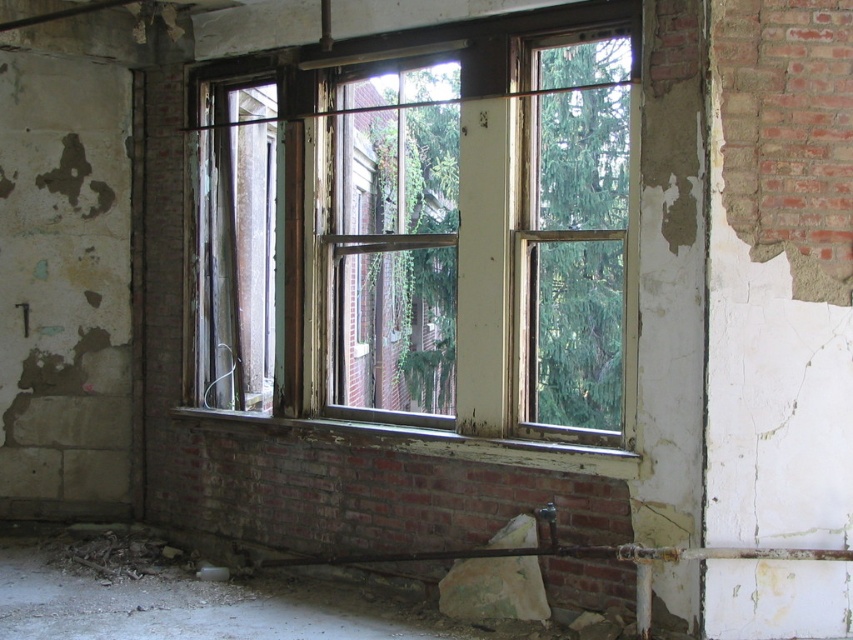
Question: Which point is closer to the camera?

Choices:
 (A) (584, 161)
 (B) (146, 570)

Answer: (A)

Question: Which of the following is the farthest from the observer?

Choices:
 (A) (200, 256)
 (B) (91, 547)

Answer: (A)

Question: Is wooden frame window at center smaller than rusty metal chain at lower left?

Choices:
 (A) yes
 (B) no

Answer: (B)

Question: Is wooden frame window at center behind rusty metal chain at lower left?

Choices:
 (A) no
 (B) yes

Answer: (A)

Question: In this image, where is wooden frame window at center located relative to rusty metal chain at lower left?

Choices:
 (A) left
 (B) right

Answer: (B)